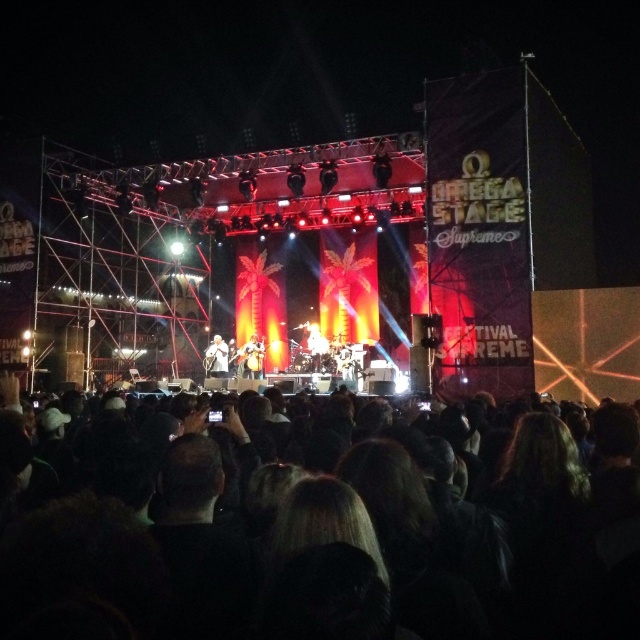
Is the position of black hair at lower center less distant than that of matte black guitar at center?

Yes, black hair at lower center is in front of matte black guitar at center.

Does black hair at lower center appear under matte black guitar at center?

Yes, black hair at lower center is below matte black guitar at center.

Which is in front, point (433, 445) or point (244, 342)?

Point (433, 445) is in front.

Where is `black hair at lower center`? This screenshot has width=640, height=640. black hair at lower center is located at coordinates (336, 556).

Does matte black guitar at center have a larger size compared to smooth skin face at center?

Yes.

Can you confirm if matte black guitar at center is positioned to the right of smooth skin face at center?

Indeed, matte black guitar at center is positioned on the right side of smooth skin face at center.

Where is `matte black guitar at center`? Image resolution: width=640 pixels, height=640 pixels. matte black guitar at center is located at coordinates (252, 356).

Does point (170, 541) come in front of point (216, 355)?

Yes, it is in front of point (216, 355).

Is point (477, 509) positioned before point (218, 364)?

Yes, it is.

The height and width of the screenshot is (640, 640). I want to click on black hair at lower center, so click(x=336, y=556).